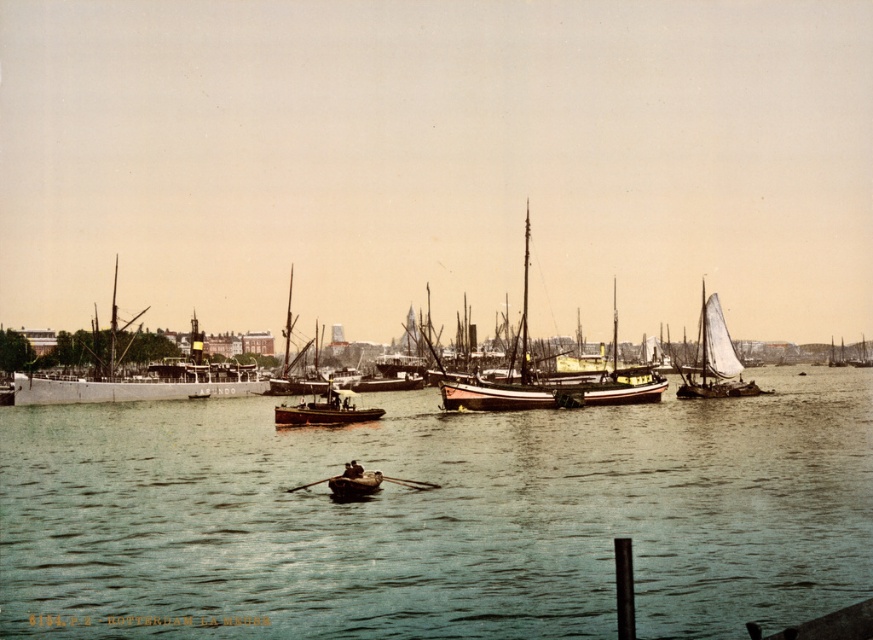
Question: Does wooden sailboat at center have a smaller size compared to white sailboat at right?

Choices:
 (A) yes
 (B) no

Answer: (B)

Question: Which of the following is the farthest from the observer?

Choices:
 (A) wooden boat at center
 (B) greenish water at center
 (C) wooden rowboat at center
 (D) white sailboat at right

Answer: (D)

Question: Which object is farther from the camera taking this photo?

Choices:
 (A) white sailboat at right
 (B) wooden sailboat at center

Answer: (A)

Question: Estimate the real-world distances between objects in this image. Which object is farther from the wooden rowboat at center?

Choices:
 (A) wooden boat at center
 (B) greenish water at center
 (C) wooden sailboat at center
 (D) white wooden ship at left

Answer: (D)

Question: Can you confirm if white wooden ship at left is wider than wooden rowboat at center?

Choices:
 (A) no
 (B) yes

Answer: (B)

Question: Is white sailboat at right wider than wooden boat at center?

Choices:
 (A) no
 (B) yes

Answer: (B)